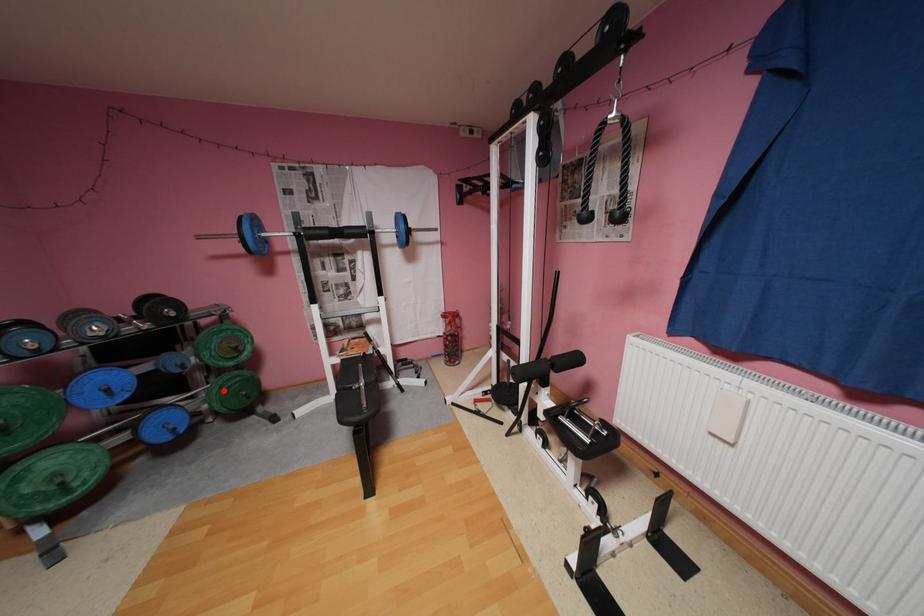
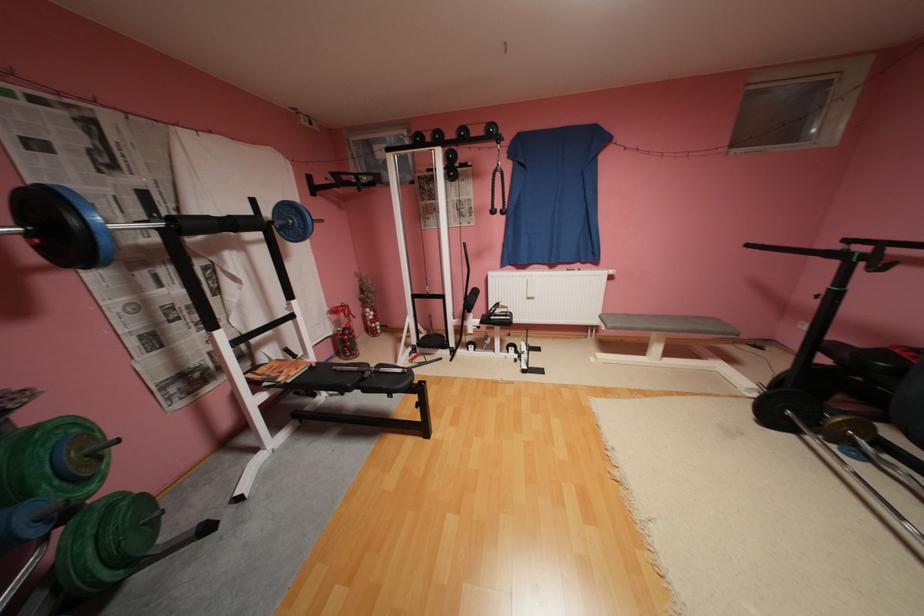
Question: I am providing you with two images of the same scene from different viewpoints. In image1, a red point is highlighted. Considering the same 3D point in image2, which of the following is correct?

Choices:
 (A) It is closer
 (B) It is farther

Answer: (B)